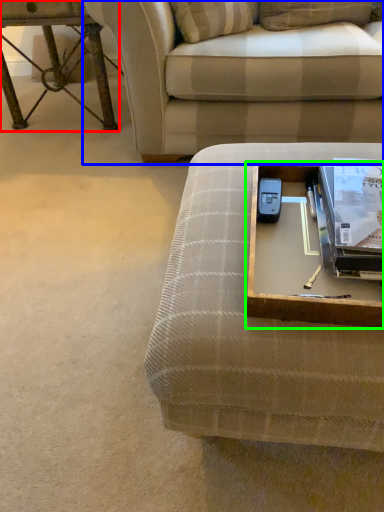
Question: Considering the real-world distances, which object is closest to table (highlighted by a red box)? studio couch (highlighted by a blue box) or round table (highlighted by a green box).

Choices:
 (A) studio couch
 (B) round table

Answer: (A)